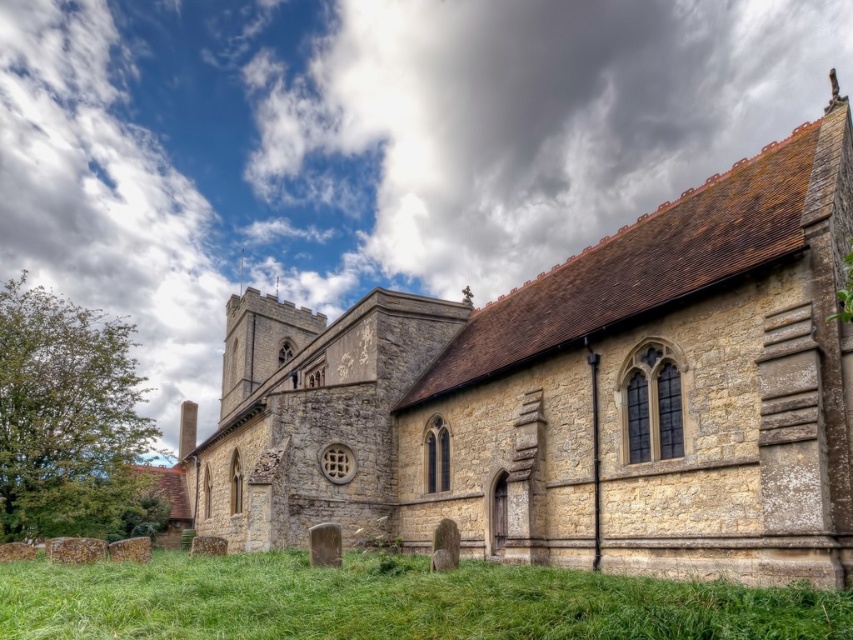
The image size is (853, 640). What do you see at coordinates (550, 116) in the screenshot?
I see `cloudy sky at upper center` at bounding box center [550, 116].

Who is positioned more to the left, cloudy sky at upper center or green grass at lower center?

Positioned to the left is green grass at lower center.

Between point (567, 68) and point (62, 609), which one is positioned behind?

The point (567, 68) is behind.

What are the coordinates of `cloudy sky at upper center` in the screenshot? It's located at (550, 116).

Who is higher up, stone church at center or cloudy sky at upper center?

cloudy sky at upper center is above.

Between stone church at center and cloudy sky at upper center, which one has more height?

stone church at center is taller.

Is point (543, 365) less distant than point (422, 262)?

That is True.

Where is `stone church at center`? The image size is (853, 640). stone church at center is located at coordinates (573, 396).

Describe the element at coordinates (573, 396) in the screenshot. The width and height of the screenshot is (853, 640). I see `stone church at center` at that location.

Does point (688, 499) come farther from viewer compared to point (67, 621)?

Yes, it is behind point (67, 621).

The height and width of the screenshot is (640, 853). Identify the location of stone church at center. (573, 396).